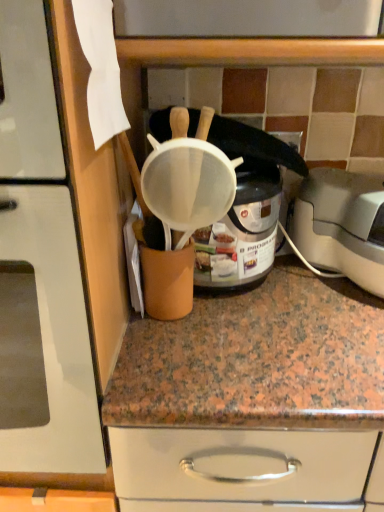
Question: Is the surface of matte white strainer at upper center in direct contact with white plastic toaster at right?

Choices:
 (A) no
 (B) yes

Answer: (A)

Question: Could you tell me if matte white strainer at upper center is turned towards white plastic toaster at right?

Choices:
 (A) no
 (B) yes

Answer: (A)

Question: From the image's perspective, would you say matte white strainer at upper center is positioned over white plastic toaster at right?

Choices:
 (A) no
 (B) yes

Answer: (B)

Question: Is matte white strainer at upper center turned away from white plastic toaster at right?

Choices:
 (A) no
 (B) yes

Answer: (A)

Question: Is matte white strainer at upper center shorter than white plastic toaster at right?

Choices:
 (A) yes
 (B) no

Answer: (B)

Question: Considering the positions of white plastic toaster at right and white mesh strainer at center in the image, is white plastic toaster at right taller or shorter than white mesh strainer at center?

Choices:
 (A) short
 (B) tall

Answer: (A)

Question: Looking at the image, does white plastic toaster at right seem bigger or smaller compared to white mesh strainer at center?

Choices:
 (A) small
 (B) big

Answer: (A)

Question: From the image's perspective, is white plastic toaster at right above or below white mesh strainer at center?

Choices:
 (A) below
 (B) above

Answer: (A)

Question: Considering their positions, is white plastic toaster at right located in front of or behind white mesh strainer at center?

Choices:
 (A) front
 (B) behind

Answer: (B)

Question: Choose the correct answer: Is matte white strainer at upper center inside white plastic toaster at right or outside it?

Choices:
 (A) outside
 (B) inside

Answer: (A)

Question: In the image, is matte white strainer at upper center positioned in front of or behind white plastic toaster at right?

Choices:
 (A) behind
 (B) front

Answer: (B)

Question: From the image's perspective, is matte white strainer at upper center positioned above or below white plastic toaster at right?

Choices:
 (A) below
 (B) above

Answer: (B)

Question: Is matte white strainer at upper center taller or shorter than white plastic toaster at right?

Choices:
 (A) tall
 (B) short

Answer: (A)

Question: Looking at the image, does matte white strainer at upper center seem bigger or smaller compared to white mesh strainer at center?

Choices:
 (A) big
 (B) small

Answer: (A)

Question: In terms of height, does matte white strainer at upper center look taller or shorter compared to white mesh strainer at center?

Choices:
 (A) tall
 (B) short

Answer: (A)